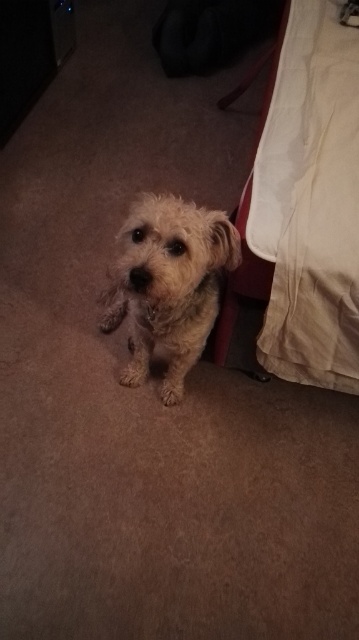
Is beige fabric bed at right taller than fuzzy fur dog at center?

Yes, beige fabric bed at right is taller than fuzzy fur dog at center.

Locate an element on the screen. This screenshot has width=359, height=640. beige fabric bed at right is located at coordinates click(x=305, y=208).